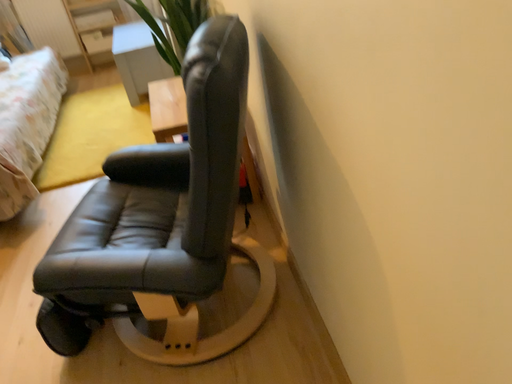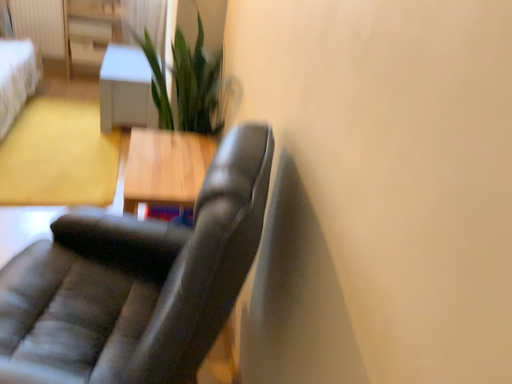
Question: How did the camera likely rotate when shooting the video?

Choices:
 (A) rotated left
 (B) rotated right

Answer: (B)